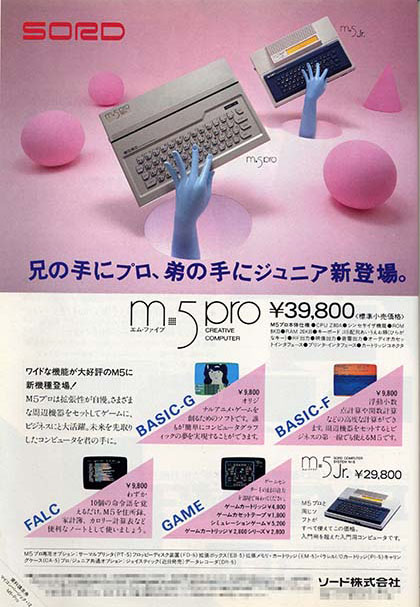
Identify the location of keyboard. The image size is (420, 607). (225, 129).